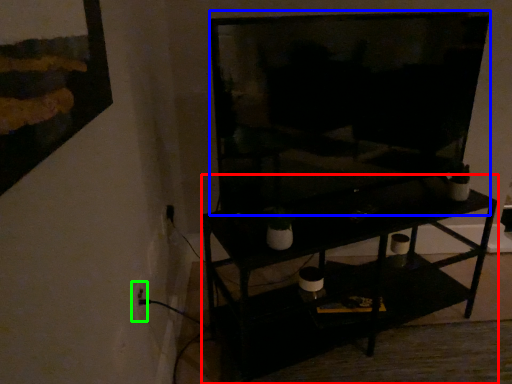
Question: Estimate the real-world distances between objects in this image. Which object is closer to shelf (highlighted by a red box), television (highlighted by a blue box) or electric outlet (highlighted by a green box)?

Choices:
 (A) television
 (B) electric outlet

Answer: (A)